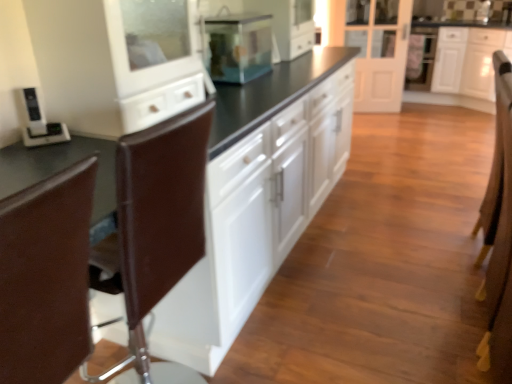
What do you see at coordinates (255, 201) in the screenshot? The height and width of the screenshot is (384, 512). I see `white glossy cabinets at center, the first cabinetry viewed from the front` at bounding box center [255, 201].

The image size is (512, 384). Identify the location of brown leather swivel chair at left, arranged as the 2th swivel chair when viewed from the back. (46, 277).

Find the location of a particular element. This screenshot has width=512, height=384. brown leather armchair at right is located at coordinates (495, 160).

The height and width of the screenshot is (384, 512). Identify the location of white glossy door at center. click(375, 54).

Image resolution: width=512 pixels, height=384 pixels. Describe the element at coordinates (158, 227) in the screenshot. I see `brown leather swivel chair at left, arranged as the first swivel chair when viewed from the back` at that location.

Locate an element on the screen. Image resolution: width=512 pixels, height=384 pixels. white glossy cabinets at center, which appears as the 1th cabinetry when viewed from the left is located at coordinates coord(255,201).

From a real-world perspective, is white glossy door at center beneath brown leather swivel chair at left, which is the 2th swivel chair from front to back?

No.

Considering the points (359, 32) and (138, 183), which point is in front, point (359, 32) or point (138, 183)?

Positioned in front is point (138, 183).

Is white glossy door at center situated inside brown leather swivel chair at left, which is the 2th swivel chair from front to back, or outside?

white glossy door at center cannot be found inside brown leather swivel chair at left, which is the 2th swivel chair from front to back.

Could you tell me if white glossy door at center is turned towards brown leather swivel chair at left, arranged as the first swivel chair when viewed from the back?

Yes, white glossy door at center is turned towards brown leather swivel chair at left, arranged as the first swivel chair when viewed from the back.

Is point (185, 232) positioned behind point (497, 199)?

No, (185, 232) is in front of (497, 199).

From the image's perspective, between brown leather swivel chair at left, arranged as the first swivel chair when viewed from the back, and brown leather armchair at right, which one is located above?

brown leather armchair at right is shown above in the image.

Considering the relative sizes of brown leather swivel chair at left, which is the 2th swivel chair from front to back, and brown leather armchair at right in the image provided, is brown leather swivel chair at left, which is the 2th swivel chair from front to back, bigger than brown leather armchair at right?

Yes.

Is brown leather swivel chair at left, which is the 2th swivel chair from front to back, far away from brown leather armchair at right?

Yes, brown leather swivel chair at left, which is the 2th swivel chair from front to back, is far from brown leather armchair at right.

Is transparent glass fish tank at center located outside black plastic phone at left?

That's correct, transparent glass fish tank at center is outside of black plastic phone at left.

Does point (225, 75) come farther from viewer compared to point (42, 127)?

Yes, point (225, 75) is behind point (42, 127).

How much distance is there between transparent glass fish tank at center and black plastic phone at left?

transparent glass fish tank at center and black plastic phone at left are 3.51 feet apart.

Between transparent glass fish tank at center and black plastic phone at left, which one has less height?

black plastic phone at left.

Is brown leather armchair at right to the left or to the right of white glossy cabinets at center, the 2th cabinetry from the back, in the image?

In the image, brown leather armchair at right appears on the right side of white glossy cabinets at center, the 2th cabinetry from the back.

From the image's perspective, which object appears higher, brown leather armchair at right or white glossy cabinets at center, the first cabinetry viewed from the front?

white glossy cabinets at center, the first cabinetry viewed from the front, is shown above in the image.

Is brown leather armchair at right positioned with its back to white glossy cabinets at center, the 2th cabinetry from the back?

Yes, white glossy cabinets at center, the 2th cabinetry from the back, is at the back of brown leather armchair at right.

Can you confirm if brown leather armchair at right is smaller than white glossy cabinets at center, the 2th cabinetry in the right-to-left sequence?

Correct, brown leather armchair at right occupies less space than white glossy cabinets at center, the 2th cabinetry in the right-to-left sequence.

Considering the relative sizes of brown leather swivel chair at left, arranged as the 2th swivel chair when viewed from the back, and black plastic phone at left in the image provided, is brown leather swivel chair at left, arranged as the 2th swivel chair when viewed from the back, taller than black plastic phone at left?

Indeed, brown leather swivel chair at left, arranged as the 2th swivel chair when viewed from the back, has a greater height compared to black plastic phone at left.

In the scene shown: Can you tell me how much brown leather swivel chair at left, which ranks as the 1th swivel chair in front-to-back order, and black plastic phone at left differ in facing direction?

139 degrees.

Which of these two, brown leather swivel chair at left, arranged as the 2th swivel chair when viewed from the back, or black plastic phone at left, is bigger?

brown leather swivel chair at left, arranged as the 2th swivel chair when viewed from the back.

Locate an element on the screen. appliance above the brown leather swivel chair at left, which ranks as the 1th swivel chair in front-to-back order (from a real-world perspective) is located at coordinates (40, 123).

How different are the orientations of brown leather swivel chair at left, which is the 2th swivel chair from front to back, and brown leather swivel chair at left, which ranks as the 1th swivel chair in front-to-back order, in degrees?

179 degrees separate the facing orientations of brown leather swivel chair at left, which is the 2th swivel chair from front to back, and brown leather swivel chair at left, which ranks as the 1th swivel chair in front-to-back order.

Is brown leather swivel chair at left, which is the 2th swivel chair from front to back, facing towards brown leather swivel chair at left, arranged as the 2th swivel chair when viewed from the back?

Yes, brown leather swivel chair at left, which is the 2th swivel chair from front to back, is turned towards brown leather swivel chair at left, arranged as the 2th swivel chair when viewed from the back.

Does brown leather swivel chair at left, arranged as the first swivel chair when viewed from the back, come in front of brown leather swivel chair at left, arranged as the 2th swivel chair when viewed from the back?

No, brown leather swivel chair at left, arranged as the first swivel chair when viewed from the back, is further to the viewer.

How far apart are brown leather swivel chair at left, arranged as the first swivel chair when viewed from the back, and brown leather swivel chair at left, arranged as the 2th swivel chair when viewed from the back?

They are 21.38 centimeters apart.

Between black plastic phone at left and brown leather swivel chair at left, which ranks as the 1th swivel chair in front-to-back order, which one has more height?

brown leather swivel chair at left, which ranks as the 1th swivel chair in front-to-back order.

This screenshot has width=512, height=384. What are the coordinates of `appliance behind the brown leather swivel chair at left, which ranks as the 1th swivel chair in front-to-back order` in the screenshot? It's located at click(40, 123).

Is black plastic phone at left bigger or smaller than brown leather swivel chair at left, arranged as the 2th swivel chair when viewed from the back?

black plastic phone at left is smaller than brown leather swivel chair at left, arranged as the 2th swivel chair when viewed from the back.

Based on the photo, which object is more forward, black plastic phone at left or brown leather swivel chair at left, arranged as the 2th swivel chair when viewed from the back?

Positioned in front is brown leather swivel chair at left, arranged as the 2th swivel chair when viewed from the back.

The image size is (512, 384). In the image, there is a white glossy door at center. Identify the location of swivel chair below it (from a real-world perspective). (x=158, y=227).

Identify the location of the 1st swivel chair in front when counting from the brown leather armchair at right. (158, 227).

Based on their spatial positions, is white glossy cabinets at center, which appears as the 1th cabinetry when viewed from the left, or white glossy cabinet at upper right, arranged as the 2th cabinetry when viewed from the left, further from brown leather armchair at right?

white glossy cabinet at upper right, arranged as the 2th cabinetry when viewed from the left, is further to brown leather armchair at right.

Looking at the image, which one is located closer to white glossy cabinets at center, the first cabinetry viewed from the front, white glossy door at center or black plastic phone at left?

black plastic phone at left lies closer to white glossy cabinets at center, the first cabinetry viewed from the front, than the other object.

Looking at the image, which one is located closer to transparent glass fish tank at center, brown leather swivel chair at left, arranged as the 2th swivel chair when viewed from the back, or white glossy door at center?

Among the two, brown leather swivel chair at left, arranged as the 2th swivel chair when viewed from the back, is located nearer to transparent glass fish tank at center.

Based on their spatial positions, is brown leather swivel chair at left, arranged as the 2th swivel chair when viewed from the back, or brown leather swivel chair at left, which is the 2th swivel chair from front to back, further from transparent glass fish tank at center?

brown leather swivel chair at left, arranged as the 2th swivel chair when viewed from the back.

Looking at the image, which one is located further to white glossy cabinets at center, the 2th cabinetry in the right-to-left sequence, black plastic phone at left or white glossy cabinet at upper right, arranged as the 2th cabinetry when viewed from the left?

white glossy cabinet at upper right, arranged as the 2th cabinetry when viewed from the left, is further to white glossy cabinets at center, the 2th cabinetry in the right-to-left sequence.

From the image, which object appears to be nearer to white glossy cabinets at center, the first cabinetry viewed from the front, brown leather swivel chair at left, which ranks as the 1th swivel chair in front-to-back order, or brown leather armchair at right?

brown leather swivel chair at left, which ranks as the 1th swivel chair in front-to-back order.

Estimate the real-world distances between objects in this image. Which object is closer to brown leather swivel chair at left, which ranks as the 1th swivel chair in front-to-back order, transparent glass fish tank at center or white glossy door at center?

transparent glass fish tank at center lies closer to brown leather swivel chair at left, which ranks as the 1th swivel chair in front-to-back order, than the other object.

Based on their spatial positions, is black plastic phone at left or white glossy door at center further from brown leather armchair at right?

white glossy door at center is positioned further to the anchor brown leather armchair at right.

This screenshot has height=384, width=512. What are the coordinates of `cabinetry positioned between brown leather swivel chair at left, arranged as the first swivel chair when viewed from the back, and transparent glass fish tank at center from near to far` in the screenshot? It's located at (255, 201).

The image size is (512, 384). What are the coordinates of `appliance positioned between brown leather swivel chair at left, which ranks as the 1th swivel chair in front-to-back order, and transparent glass fish tank at center from near to far` in the screenshot? It's located at (40, 123).

You are a GUI agent. You are given a task and a screenshot of the screen. Output one action in this format:
    pyautogui.click(x=<x>, y=<y>)
    Task: Click on the home appliance positioned between white glossy cabinets at center, the first cabinetry viewed from the front, and white glossy door at center from near to far
    The image size is (512, 384).
    Given the screenshot: What is the action you would take?
    pyautogui.click(x=238, y=47)

Find the location of `home appliance situated between black plastic phone at left and white glossy cabinet at upper right, which ranks as the 2th cabinetry in front-to-back order, from left to right`. home appliance situated between black plastic phone at left and white glossy cabinet at upper right, which ranks as the 2th cabinetry in front-to-back order, from left to right is located at coordinates (238, 47).